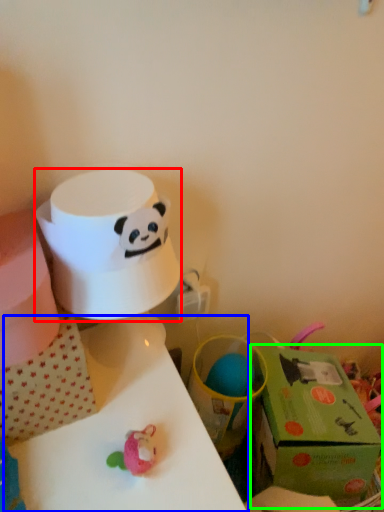
Question: Considering the real-world distances, which object is farthest from paper towel (highlighted by a red box)? table (highlighted by a blue box) or gift box (highlighted by a green box)?

Choices:
 (A) table
 (B) gift box

Answer: (B)